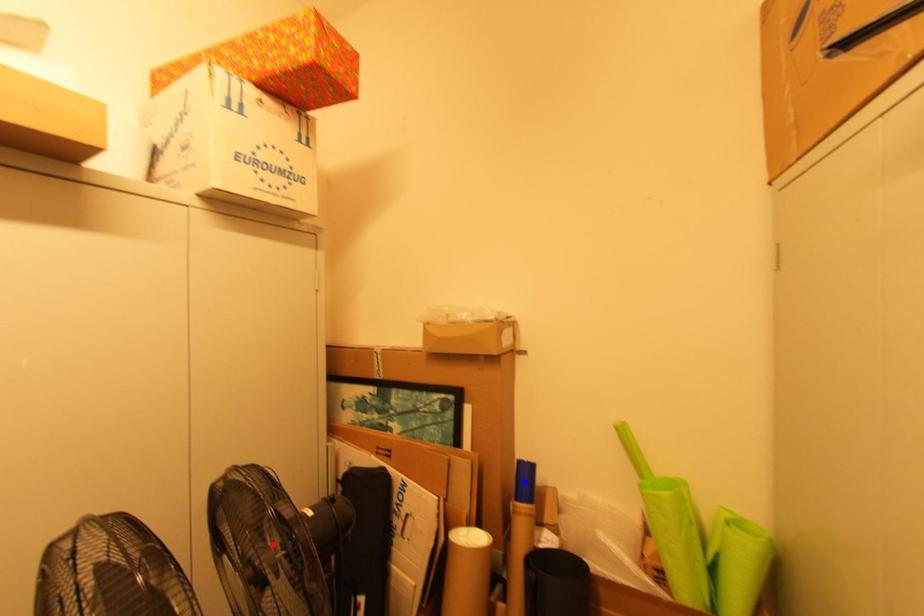
Question: Two points are marked on the image. Which point is closer to the camera?

Choices:
 (A) Blue point is closer.
 (B) Red point is closer.

Answer: (B)